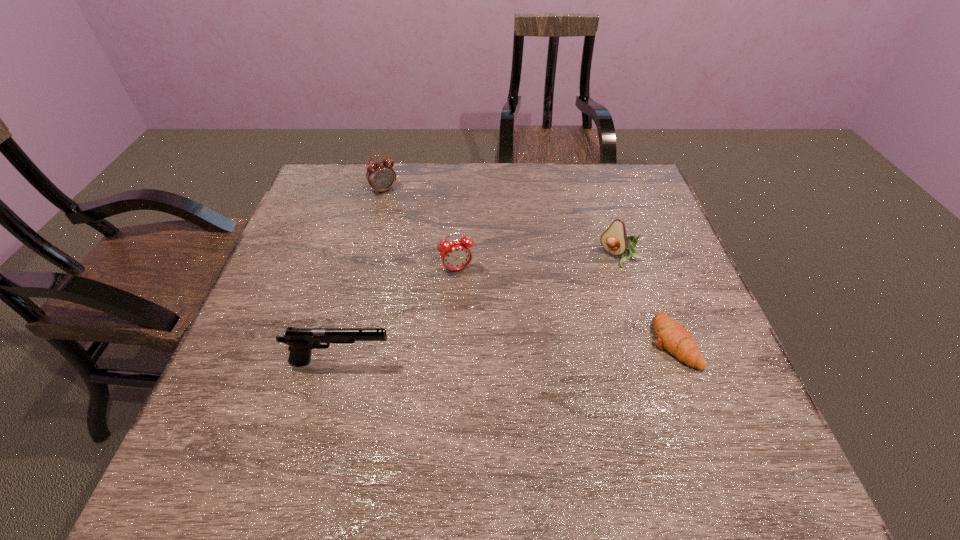
What are the coordinates of `vacant space that is in between the shortest object and the nearer alarm clock` in the screenshot? It's located at (564, 306).

Find the location of a particular element. This screenshot has height=540, width=960. free space between the nearer alarm clock and the farther alarm clock is located at coordinates (420, 230).

Identify the location of free space between the shortest object and the gun. This screenshot has height=540, width=960. (507, 352).

Where is `blank region between the shortest object and the farthest object`? The height and width of the screenshot is (540, 960). blank region between the shortest object and the farthest object is located at coordinates (528, 266).

Locate an element on the screen. The width and height of the screenshot is (960, 540). vacant space that's between the left alarm clock and the nearer alarm clock is located at coordinates (420, 230).

What are the coordinates of `vacant area that lies between the right alarm clock and the avocado` in the screenshot? It's located at (539, 264).

I want to click on vacant area that lies between the gun and the avocado, so click(481, 309).

Image resolution: width=960 pixels, height=540 pixels. I want to click on free space between the gun and the nearer alarm clock, so click(398, 316).

The width and height of the screenshot is (960, 540). What are the coordinates of `object that can be found as the fourth closest to the crescent roll` in the screenshot? It's located at (381, 176).

Identify the location of the fourth closest object relative to the avocado. This screenshot has width=960, height=540. (381, 176).